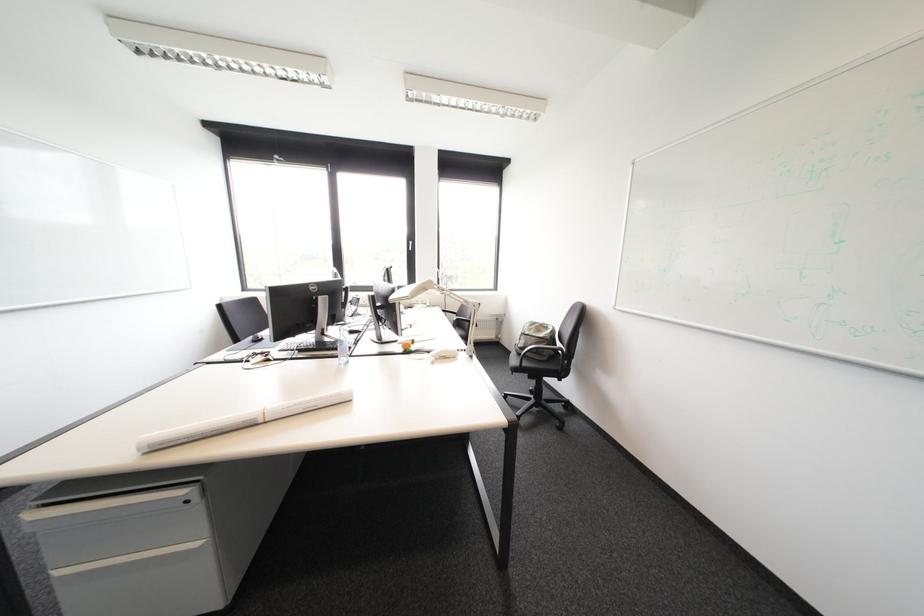
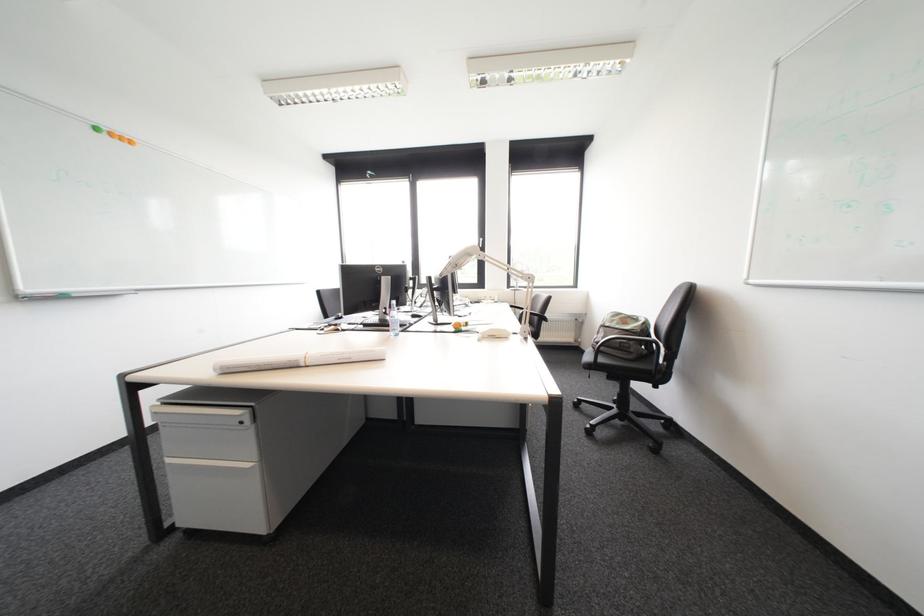
In a continuous first-person perspective shot, in which direction is the camera moving?

The movement direction of the cameraman is right, forward.